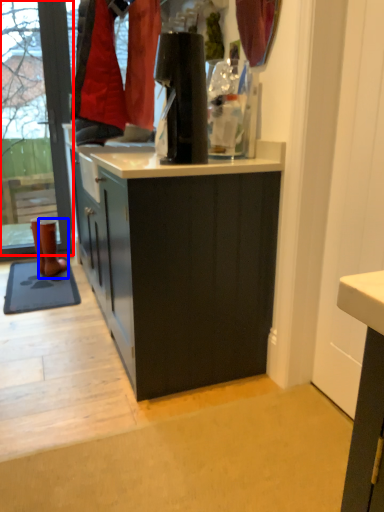
Question: Among these objects, which one is nearest to the camera, shop window (highlighted by a red box) or footwear (highlighted by a blue box)?

Choices:
 (A) shop window
 (B) footwear

Answer: (A)